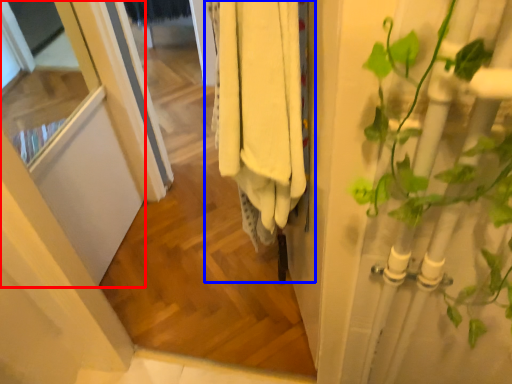
Question: Among these objects, which one is farthest to the camera, screen door (highlighted by a red box) or closet (highlighted by a blue box)?

Choices:
 (A) screen door
 (B) closet

Answer: (A)